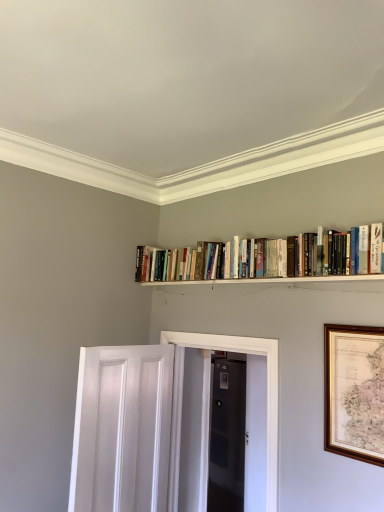
Question: Is white painted wood door at lower left, which is counted as the 2th door, starting from the right, in front of or behind white wooden shelf at upper center in the image?

Choices:
 (A) behind
 (B) front

Answer: (A)

Question: From the image's perspective, is white painted wood door at lower left, which is counted as the 2th door, starting from the right, positioned above or below white wooden shelf at upper center?

Choices:
 (A) above
 (B) below

Answer: (B)

Question: Considering the real-world distances, which object is closest to the white glossy elevator at center?

Choices:
 (A) wooden framed map at right
 (B) black glossy door at center, the first door in the right-to-left sequence
 (C) white painted wood door at lower left, placed as the 1th door when sorted from left to right
 (D) white wooden shelf at upper center

Answer: (C)

Question: Considering the real-world distances, which object is closest to the black glossy door at center, which is the first door from back to front?

Choices:
 (A) white glossy elevator at center
 (B) white painted wood door at lower left, which is counted as the 2th door, starting from the right
 (C) wooden framed map at right
 (D) white wooden shelf at upper center

Answer: (A)